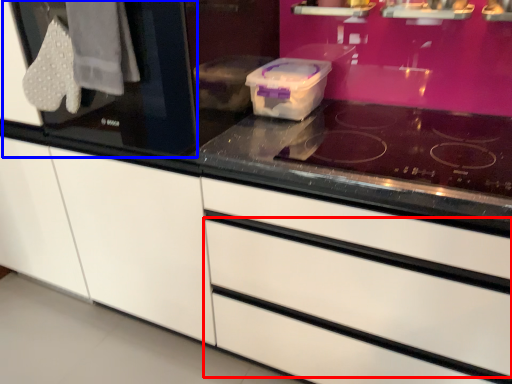
Question: Which of the following is the farthest to the observer, drawer (highlighted by a red box) or glass door (highlighted by a blue box)?

Choices:
 (A) drawer
 (B) glass door

Answer: (B)